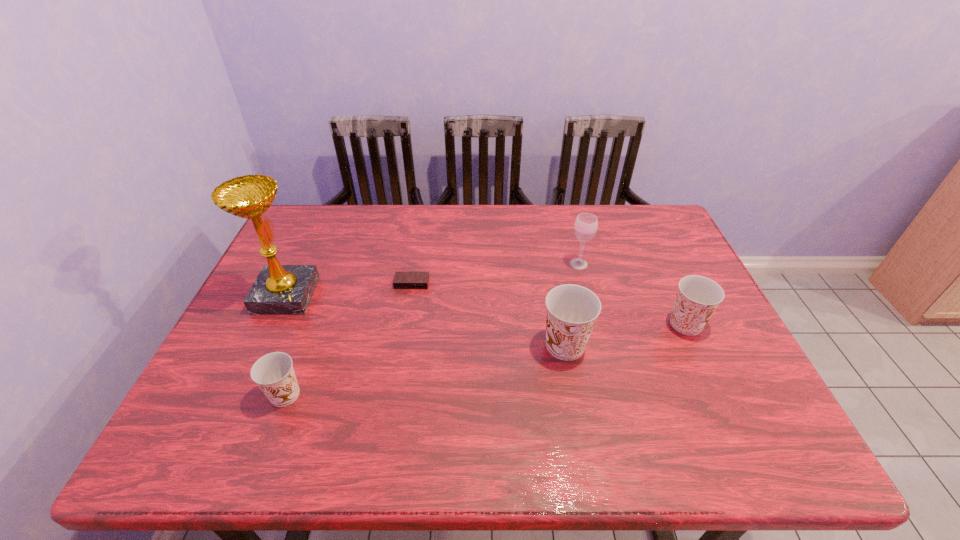
Locate an element on the screen. vacant space located 0.180m on the left of the second Dixie cup from right to left is located at coordinates (468, 346).

I want to click on vacant space located 0.150m on the back of the second tallest Dixie cup, so click(662, 273).

Where is `vacant space positioned 0.250m on the right of the wineglass`? Image resolution: width=960 pixels, height=540 pixels. vacant space positioned 0.250m on the right of the wineglass is located at coordinates (673, 264).

The image size is (960, 540). Identify the location of vacant region located 0.140m on the front face of the shortest object. (404, 327).

This screenshot has width=960, height=540. I want to click on vacant region located 0.310m on the front-facing side of the award, so click(424, 295).

Find the location of `object located in the near edge section of the desktop`. object located in the near edge section of the desktop is located at coordinates (274, 374).

The image size is (960, 540). What are the coordinates of `Dixie cup situated at the left edge` in the screenshot? It's located at (274, 374).

Locate an element on the screen. The height and width of the screenshot is (540, 960). award positioned at the left edge is located at coordinates (279, 289).

This screenshot has height=540, width=960. I want to click on object that is positioned at the right edge, so click(x=697, y=298).

You are a GUI agent. You are given a task and a screenshot of the screen. Output one action in this format:
    pyautogui.click(x=<x>, y=<y>)
    Task: Click on the object positioned at the near left corner
    
    Given the screenshot: What is the action you would take?
    pyautogui.click(x=274, y=374)